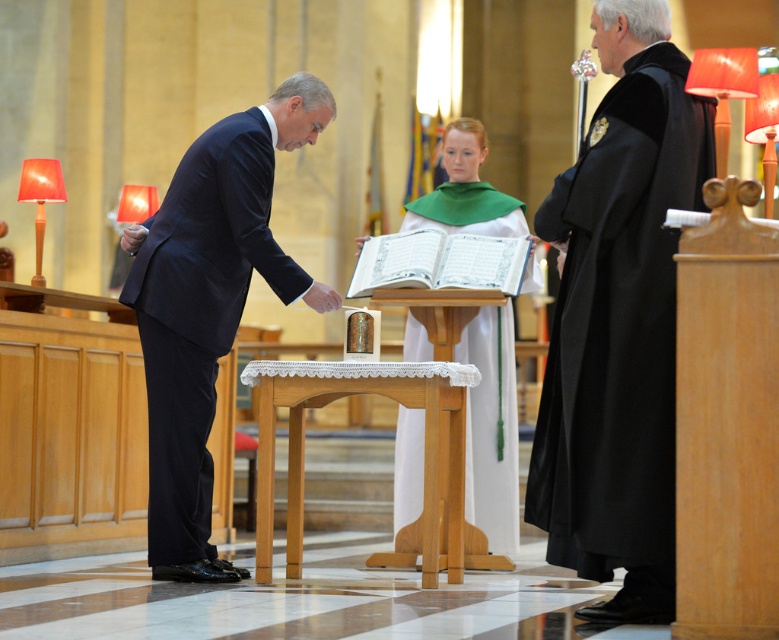
Question: Can you confirm if wooden altar at center is positioned to the right of white cloth at center?

Choices:
 (A) yes
 (B) no

Answer: (B)

Question: Does dark blue suit at left have a lesser width compared to wooden altar at center?

Choices:
 (A) yes
 (B) no

Answer: (A)

Question: Which point is farther from the camera taking this photo?

Choices:
 (A) [x=301, y=538]
 (B) [x=501, y=540]
 (C) [x=270, y=275]
 (D) [x=633, y=124]

Answer: (B)

Question: Among these objects, which one is farthest from the camera?

Choices:
 (A) dark blue suit at left
 (B) wooden altar at center
 (C) black velvet robe at right

Answer: (A)

Question: Can you confirm if black velvet robe at right is wider than white cloth at center?

Choices:
 (A) yes
 (B) no

Answer: (B)

Question: Which point is farther from the camera taking this photo?

Choices:
 (A) (280, 291)
 (B) (545, 204)
 (C) (409, 452)

Answer: (C)